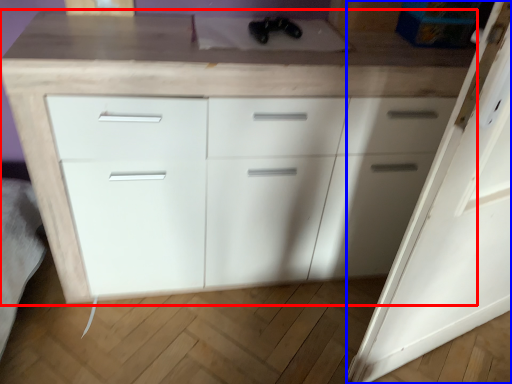
Question: Which point is further to the camera, chest of drawers (highlighted by a red box) or door (highlighted by a blue box)?

Choices:
 (A) chest of drawers
 (B) door

Answer: (A)